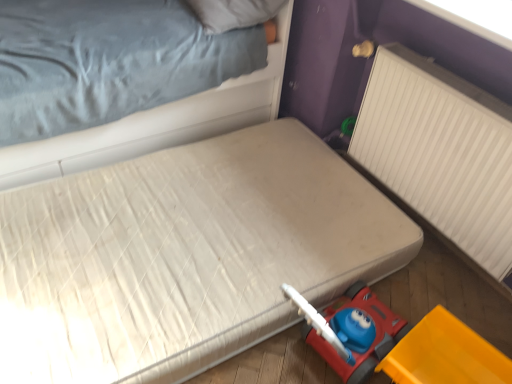
Question: In terms of size, does white ribbed radiator at right appear bigger or smaller than white soft pillow at upper center?

Choices:
 (A) small
 (B) big

Answer: (B)

Question: From their relative heights in the image, would you say white ribbed radiator at right is taller or shorter than white soft pillow at upper center?

Choices:
 (A) tall
 (B) short

Answer: (A)

Question: Which of these objects is positioned farthest from the white fabric bed at upper left, marked as the 1th bed in a top-to-bottom arrangement?

Choices:
 (A) yellow plastic toy car at lower right
 (B) white quilted mattress at lower right, the first bed when ordered from bottom to top
 (C) white soft pillow at upper center
 (D) white ribbed radiator at right

Answer: (A)

Question: Which of these objects is positioned farthest from the white quilted mattress at lower right, the first bed when ordered from bottom to top?

Choices:
 (A) white ribbed radiator at right
 (B) yellow plastic toy car at lower right
 (C) white soft pillow at upper center
 (D) white fabric bed at upper left, marked as the 1th bed in a top-to-bottom arrangement

Answer: (C)